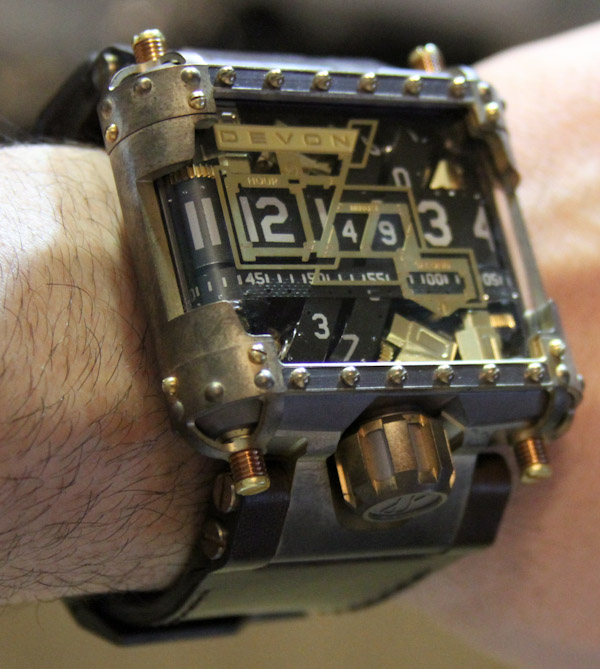
Image resolution: width=600 pixels, height=669 pixels. I want to click on knob, so click(406, 502).